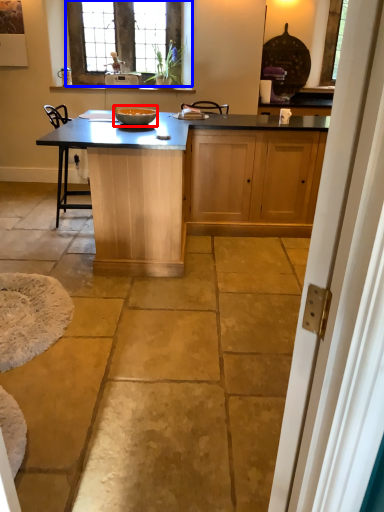
Question: Which object appears closest to the camera in this image, bowl (highlighted by a red box) or window (highlighted by a blue box)?

Choices:
 (A) bowl
 (B) window

Answer: (A)